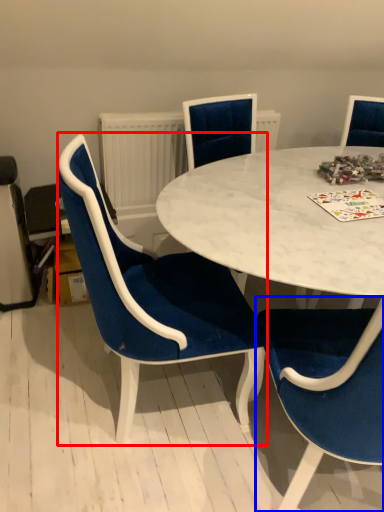
Question: Which of the following is the farthest to the observer, chair (highlighted by a red box) or chair (highlighted by a blue box)?

Choices:
 (A) chair
 (B) chair

Answer: (A)